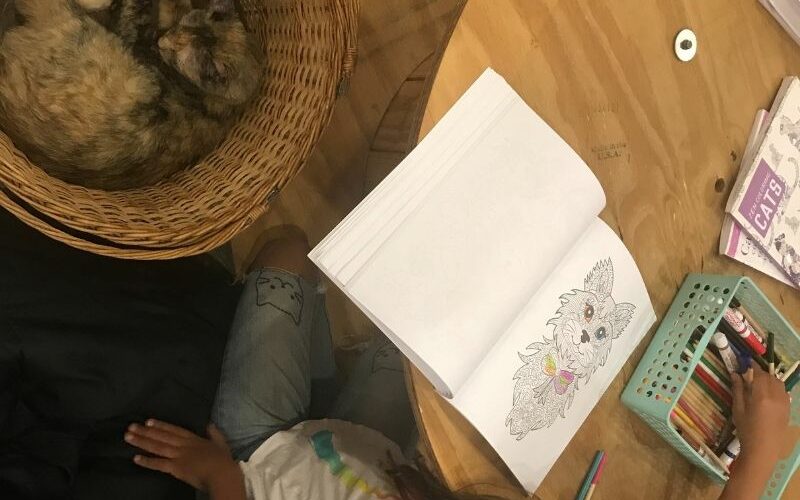
This screenshot has height=500, width=800. I want to click on round unfinished wooden art table, so click(613, 102).